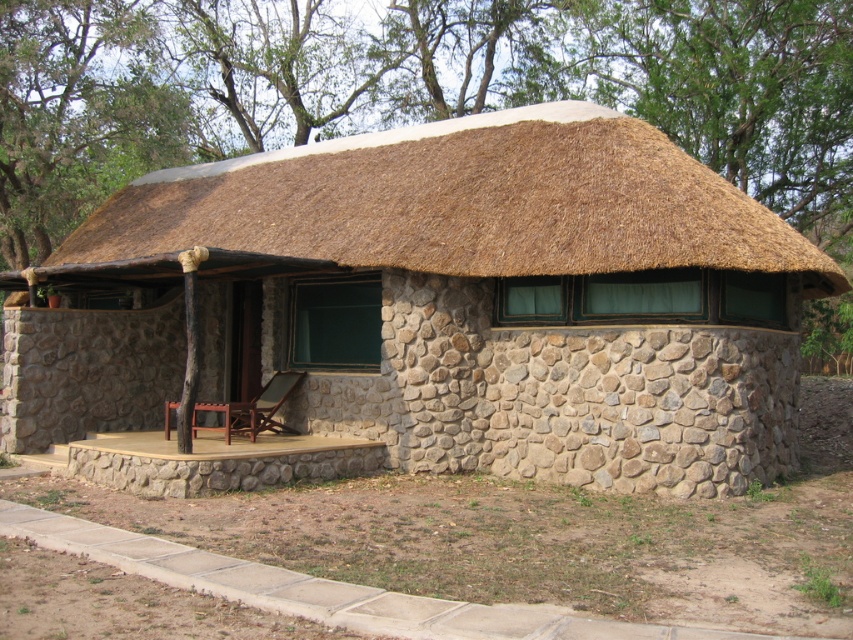
Can you confirm if thatched straw roof at upper center is shorter than wooden deck chair at lower center?

No, thatched straw roof at upper center is not shorter than wooden deck chair at lower center.

Can you confirm if thatched straw roof at upper center is positioned below wooden deck chair at lower center?

Actually, thatched straw roof at upper center is above wooden deck chair at lower center.

Who is more forward, [566,246] or [276,390]?

Point [566,246]

Where is `thatched straw roof at upper center`? This screenshot has width=853, height=640. thatched straw roof at upper center is located at coordinates (463, 204).

Image resolution: width=853 pixels, height=640 pixels. Describe the element at coordinates (445, 304) in the screenshot. I see `stone textured hut at center` at that location.

Is point (689, 317) closer to camera compared to point (641, 266)?

No, it is not.

This screenshot has width=853, height=640. What are the coordinates of `stone textured hut at center` in the screenshot? It's located at (445, 304).

Can you confirm if stone textured hut at center is positioned to the left of wooden deck chair at lower center?

No, stone textured hut at center is not to the left of wooden deck chair at lower center.

Is stone textured hut at center below wooden deck chair at lower center?

No.

What are the coordinates of `stone textured hut at center` in the screenshot? It's located at (445, 304).